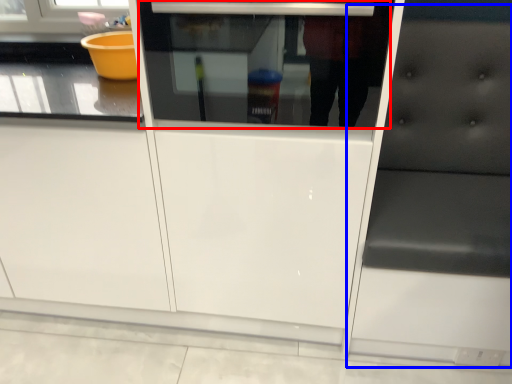
Question: Which of the following is the farthest to the observer, oven (highlighted by a red box) or furniture (highlighted by a blue box)?

Choices:
 (A) oven
 (B) furniture

Answer: (A)